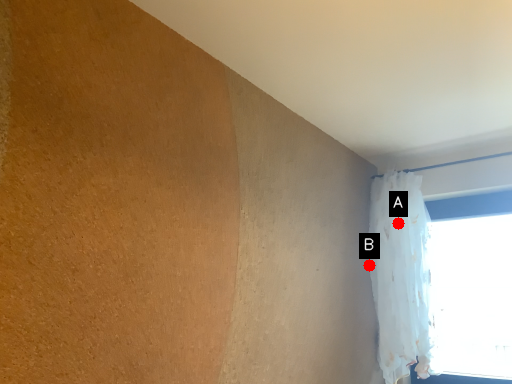
Question: Two points are circled on the image, labeled by A and B beside each circle. Which point is closer to the camera?

Choices:
 (A) A is closer
 (B) B is closer

Answer: (A)